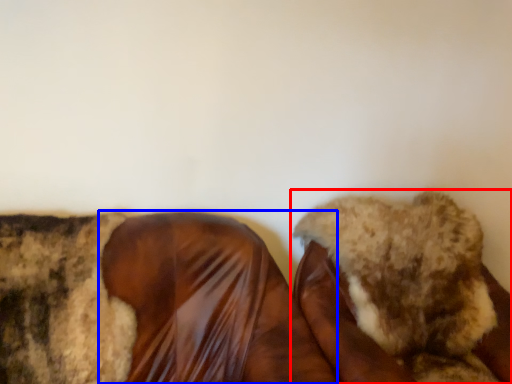
Question: Which of the following is the closest to the observer, footwear (highlighted by a red box) or footwear (highlighted by a blue box)?

Choices:
 (A) footwear
 (B) footwear

Answer: (B)